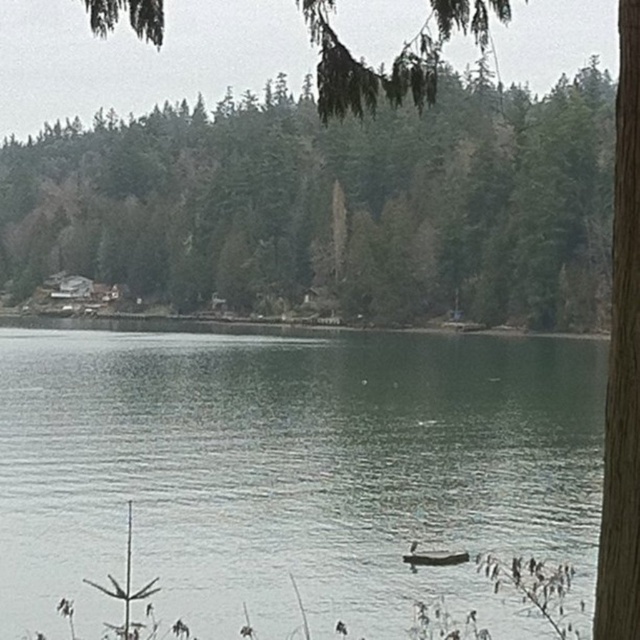
You are standing at the lakeside and want to take a photo of the green smooth water at center and the green leafy tree at upper center. Which object will appear closer to you in the photo?

The green smooth water at center will appear closer to you in the photo because it is further to the viewer than the green leafy tree at upper center.

You are standing at the edge of the lake and want to locate the green matte tree at center. According to the coordinates provided, where should you look relative to your position?

The green matte tree at center is located at coordinates point (328, 208), which means it is positioned 32.5 percent from the left edge and 51.4 percent from the top edge of the image.

You are standing on the lakeside dock and looking towards the trees. Which tree is closer to you, the green matte tree at center or the green leafy tree at upper center?

The green matte tree at center is closer to you because the green leafy tree at upper center is positioned behind it.